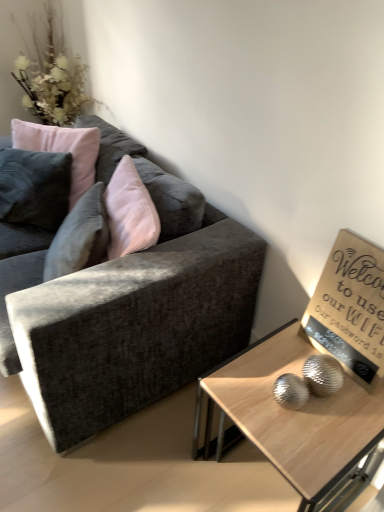
You are a GUI agent. You are given a task and a screenshot of the screen. Output one action in this format:
    pyautogui.click(x=<x>, y=<y>)
    Task: Click on the free space above wooden glossy coffee table at lower right (from a real-world perspective)
    This screenshot has height=512, width=384.
    Given the screenshot: What is the action you would take?
    tap(303, 403)